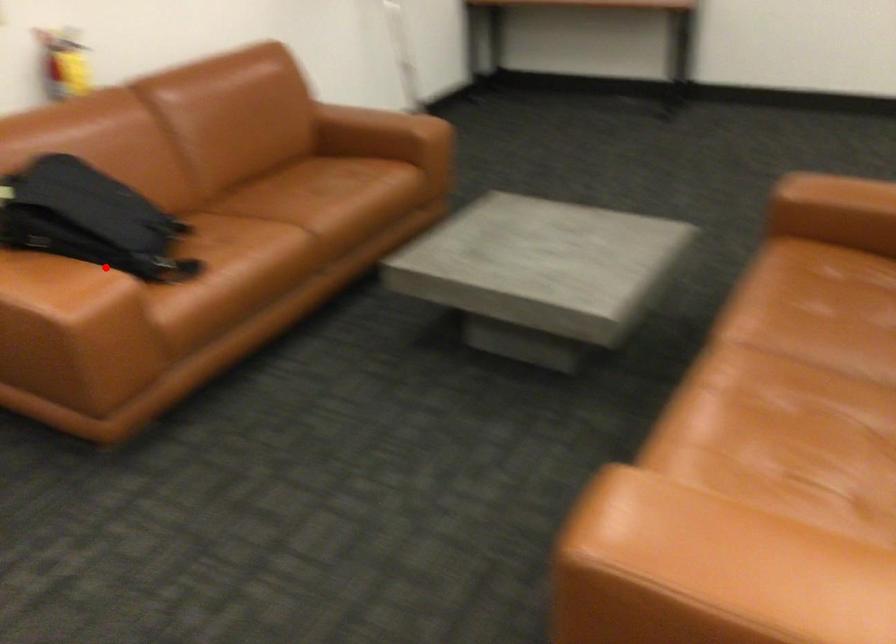
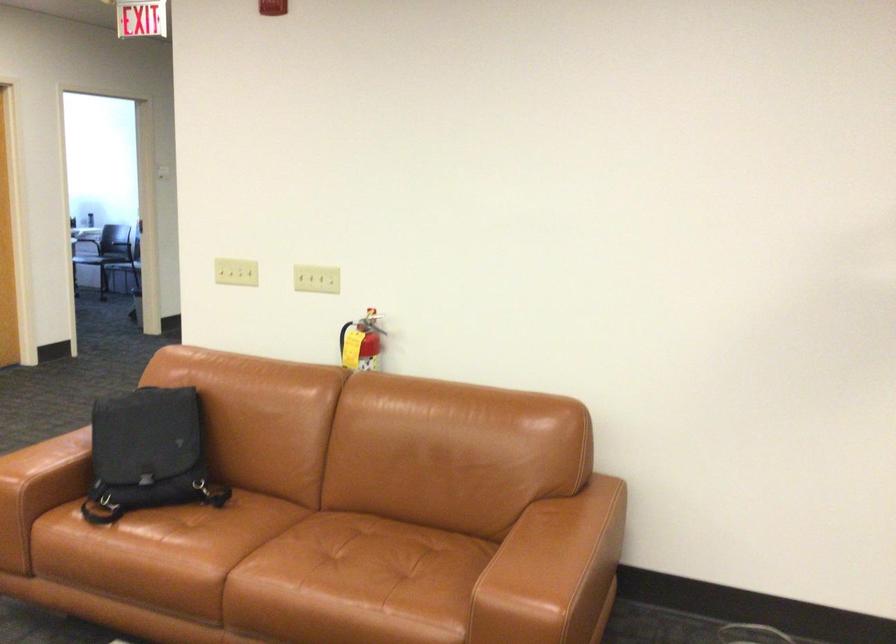
Question: I am providing you with two images of the same scene from different viewpoints. Given a red point in image1, look at the same physical point in image2. Is it:

Choices:
 (A) Closer to the viewpoint
 (B) Farther from the viewpoint

Answer: (B)